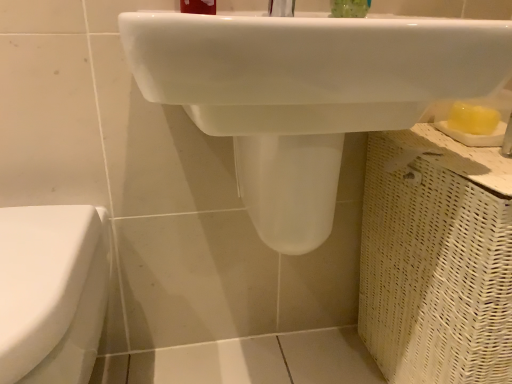
Question: Should I look upward or downward to see green translucent soap at upper center?

Choices:
 (A) down
 (B) up

Answer: (B)

Question: Is white glossy toilet at left oriented towards green translucent soap at upper center?

Choices:
 (A) no
 (B) yes

Answer: (A)

Question: Considering the relative sizes of white glossy toilet at left and green translucent soap at upper center in the image provided, is white glossy toilet at left wider than green translucent soap at upper center?

Choices:
 (A) yes
 (B) no

Answer: (A)

Question: Considering the relative positions of white glossy toilet at left and green translucent soap at upper center in the image provided, is white glossy toilet at left to the right of green translucent soap at upper center from the viewer's perspective?

Choices:
 (A) no
 (B) yes

Answer: (A)

Question: Does white glossy toilet at left come behind green translucent soap at upper center?

Choices:
 (A) yes
 (B) no

Answer: (B)

Question: Does white glossy toilet at left have a smaller size compared to green translucent soap at upper center?

Choices:
 (A) no
 (B) yes

Answer: (A)

Question: Is white glossy toilet at left directly adjacent to green translucent soap at upper center?

Choices:
 (A) no
 (B) yes

Answer: (A)

Question: Considering the relative positions of green translucent soap at upper center and white glossy toilet at left in the image provided, is green translucent soap at upper center to the right of white glossy toilet at left from the viewer's perspective?

Choices:
 (A) yes
 (B) no

Answer: (A)

Question: From a real-world perspective, is green translucent soap at upper center located beneath white glossy toilet at left?

Choices:
 (A) yes
 (B) no

Answer: (B)

Question: Is the position of green translucent soap at upper center more distant than that of white glossy toilet at left?

Choices:
 (A) yes
 (B) no

Answer: (A)

Question: Can we say green translucent soap at upper center lies outside white glossy toilet at left?

Choices:
 (A) no
 (B) yes

Answer: (B)

Question: Is green translucent soap at upper center at the left side of white glossy toilet at left?

Choices:
 (A) yes
 (B) no

Answer: (B)

Question: From the image's perspective, does green translucent soap at upper center appear lower than white glossy toilet at left?

Choices:
 (A) yes
 (B) no

Answer: (B)

Question: Is matte plastic toothbrush at upper center located outside green translucent soap at upper center?

Choices:
 (A) no
 (B) yes

Answer: (B)